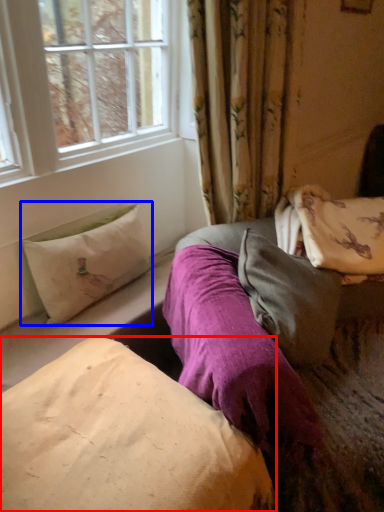
Question: Which object is further to the camera taking this photo, pillow (highlighted by a red box) or pillow (highlighted by a blue box)?

Choices:
 (A) pillow
 (B) pillow

Answer: (B)